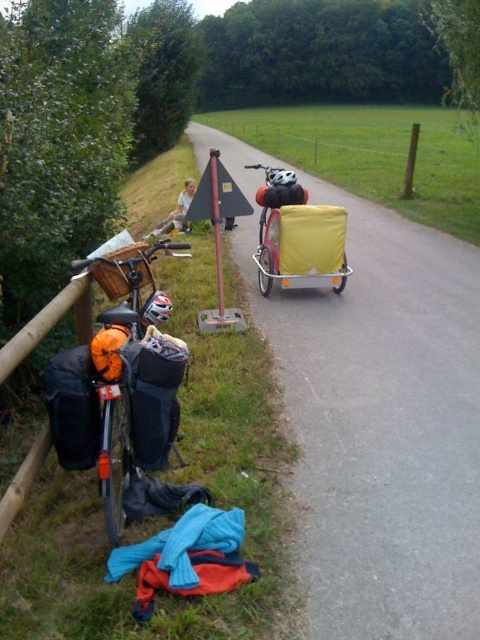
Question: Which of these objects is positioned farthest from the yellow fabric cargo at center?

Choices:
 (A) yellow fabric cart at center
 (B) orange fabric bag at left

Answer: (B)

Question: Which point is farther to the camera?

Choices:
 (A) wooden post at center
 (B) yellow fabric cargo at center

Answer: (A)

Question: Which object is closer to the camera taking this photo?

Choices:
 (A) orange fabric bag at left
 (B) wooden post at center

Answer: (A)

Question: Is yellow fabric cart at center bigger than wooden post at center?

Choices:
 (A) no
 (B) yes

Answer: (A)

Question: Does orange fabric bag at left appear over yellow fabric cart at center?

Choices:
 (A) no
 (B) yes

Answer: (A)

Question: From the image, what is the correct spatial relationship of yellow fabric cart at center in relation to wooden post at center?

Choices:
 (A) above
 (B) below

Answer: (B)